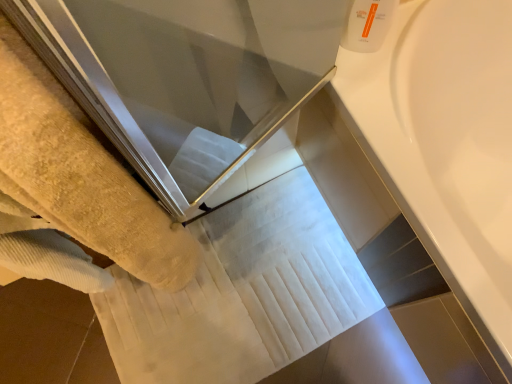
This screenshot has width=512, height=384. In order to click on white glossy bathtub at upper right in this screenshot , I will do `click(446, 144)`.

Can you confirm if white glossy bathtub at upper right is taller than white plastic bottle at upper right?

Yes.

Is white glossy bathtub at upper right not within white plastic bottle at upper right?

white glossy bathtub at upper right is positioned outside white plastic bottle at upper right.

In terms of size, does white glossy bathtub at upper right appear bigger or smaller than white plastic bottle at upper right?

Considering their sizes, white glossy bathtub at upper right takes up more space than white plastic bottle at upper right.

Is white glossy bathtub at upper right far from white plastic bottle at upper right?

white glossy bathtub at upper right is near white plastic bottle at upper right, not far away.

The width and height of the screenshot is (512, 384). What are the coordinates of `towel below the white plastic bottle at upper right (from the image's perspective)` in the screenshot? It's located at (80, 174).

From a real-world perspective, is yellow terry towel at left above or below white plastic bottle at upper right?

In terms of real-world spatial position, yellow terry towel at left is below white plastic bottle at upper right.

Does point (100, 235) appear closer or farther from the camera than point (390, 5)?

Point (100, 235).

Which of these two, yellow terry towel at left or white plastic bottle at upper right, is thinner?

white plastic bottle at upper right is thinner.

How distant is white plastic bottle at upper right from yellow terry towel at left?

white plastic bottle at upper right and yellow terry towel at left are 19.84 inches apart from each other.

Between white plastic bottle at upper right and yellow terry towel at left, which one has larger size?

With larger size is yellow terry towel at left.

Is white plastic bottle at upper right turned away from yellow terry towel at left?

No, yellow terry towel at left is not at the back of white plastic bottle at upper right.

Is white plastic bottle at upper right outside of yellow terry towel at left?

Yes.

How much distance is there between white glossy bathtub at upper right and yellow terry towel at left?

They are 21.92 inches apart.

Can you confirm if white glossy bathtub at upper right is positioned to the right of yellow terry towel at left?

Indeed, white glossy bathtub at upper right is positioned on the right side of yellow terry towel at left.

Is white glossy bathtub at upper right far from yellow terry towel at left?

white glossy bathtub at upper right is near yellow terry towel at left, not far away.

Is point (428, 20) closer or farther from the camera than point (60, 158)?

Point (428, 20) is farther from the camera than point (60, 158).

From the image's perspective, relative to white glossy bathtub at upper right, is yellow terry towel at left above or below?

yellow terry towel at left is situated lower than white glossy bathtub at upper right in the image.

Does yellow terry towel at left have a greater width compared to white glossy bathtub at upper right?

In fact, yellow terry towel at left might be narrower than white glossy bathtub at upper right.

I want to click on bath on the right of yellow terry towel at left, so click(446, 144).

Which object is further away from the camera, white plastic bottle at upper right or white glossy bathtub at upper right?

white plastic bottle at upper right is behind.

From the image's perspective, which is below, white plastic bottle at upper right or white glossy bathtub at upper right?

white glossy bathtub at upper right, from the image's perspective.

Consider the image. Is white plastic bottle at upper right oriented away from white glossy bathtub at upper right?

white plastic bottle at upper right is not turned away from white glossy bathtub at upper right.

Is white plastic bottle at upper right smaller than white glossy bathtub at upper right?

Yes.

Identify the location of toiletry that is above the white glossy bathtub at upper right (from a real-world perspective). (367, 24).

This screenshot has width=512, height=384. I want to click on towel in front of the white plastic bottle at upper right, so click(80, 174).

Looking at the image, which one is located closer to white glossy bathtub at upper right, white plastic bottle at upper right or yellow terry towel at left?

white plastic bottle at upper right lies closer to white glossy bathtub at upper right than the other object.

From the picture: Considering their positions, is yellow terry towel at left positioned further to white glossy bathtub at upper right than white plastic bottle at upper right?

yellow terry towel at left is positioned further to the anchor white glossy bathtub at upper right.

Looking at the image, which one is located further to yellow terry towel at left, white glossy bathtub at upper right or white plastic bottle at upper right?

white glossy bathtub at upper right is positioned further to the anchor yellow terry towel at left.

Which object lies nearer to the anchor point white plastic bottle at upper right, yellow terry towel at left or white glossy bathtub at upper right?

white glossy bathtub at upper right.

When comparing their distances from white plastic bottle at upper right, does white glossy bathtub at upper right or yellow terry towel at left seem further?

yellow terry towel at left is further to white plastic bottle at upper right.

Looking at this image, when comparing their distances from yellow terry towel at left, does white plastic bottle at upper right or white glossy bathtub at upper right seem further?

white glossy bathtub at upper right.

This screenshot has height=384, width=512. I want to click on toiletry between yellow terry towel at left and white glossy bathtub at upper right from left to right, so click(367, 24).